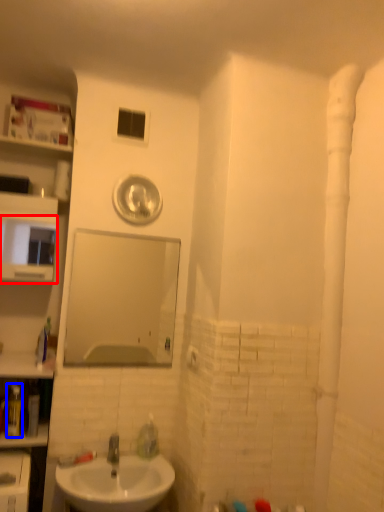
Question: Among these objects, which one is farthest to the camera, medicine cabinet (highlighted by a red box) or toiletry (highlighted by a blue box)?

Choices:
 (A) medicine cabinet
 (B) toiletry

Answer: (A)